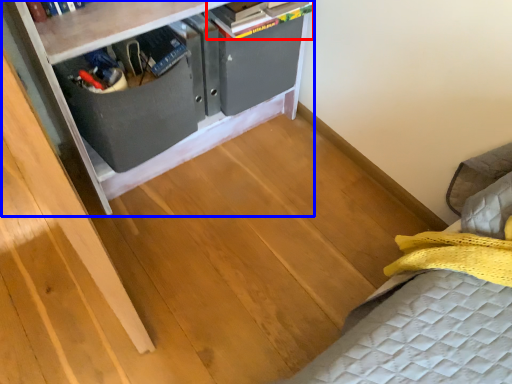
Question: Which of the following is the closest to the observer, book (highlighted by a red box) or furniture (highlighted by a blue box)?

Choices:
 (A) book
 (B) furniture

Answer: (B)